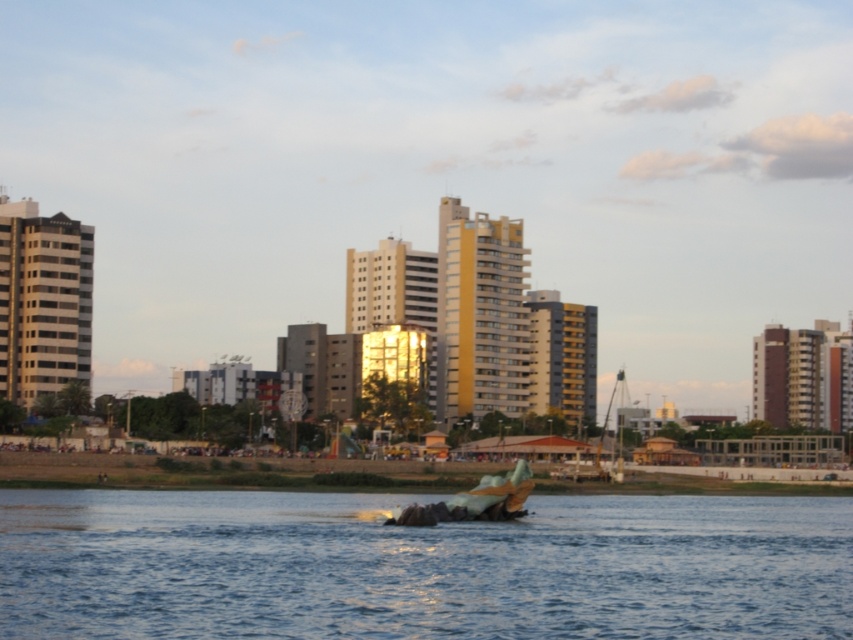
Is smooth concrete shoreline at center behind metallic silver boat at center?

No.

Does smooth concrete shoreline at center appear over metallic silver boat at center?

Actually, smooth concrete shoreline at center is below metallic silver boat at center.

What do you see at coordinates (230, 472) in the screenshot? I see `smooth concrete shoreline at center` at bounding box center [230, 472].

Find the location of a particular element. smooth concrete shoreline at center is located at coordinates tap(230, 472).

In the scene shown: Who is shorter, blue water at center or smooth concrete shoreline at center?

With less height is smooth concrete shoreline at center.

Is blue water at center in front of smooth concrete shoreline at center?

Yes.

Where is `blue water at center`? The width and height of the screenshot is (853, 640). blue water at center is located at coordinates (421, 566).

Does blue water at center appear on the left side of metallic silver boat at center?

Indeed, blue water at center is positioned on the left side of metallic silver boat at center.

Between point (49, 570) and point (605, 476), which one is positioned in front?

Point (49, 570) is more forward.

Is point (531, 554) positioned before point (549, 476)?

Yes, it is in front of point (549, 476).

This screenshot has width=853, height=640. I want to click on blue water at center, so click(421, 566).